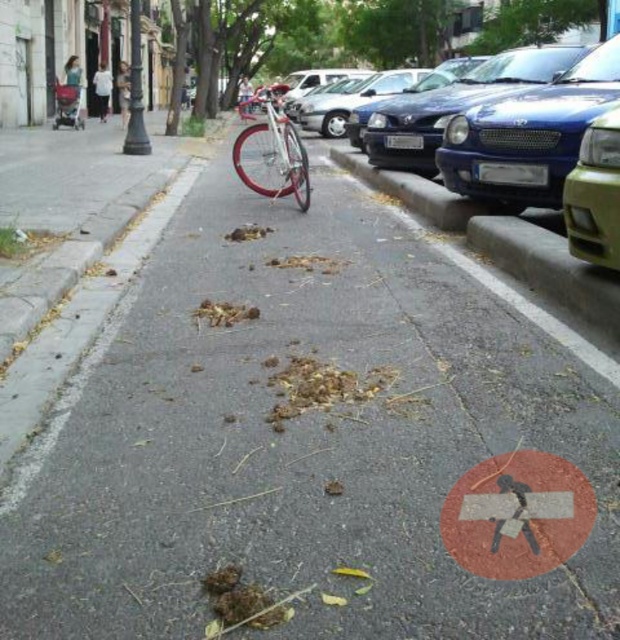
Question: Which object is farther from the camera taking this photo?

Choices:
 (A) red painted pedestrian crossing sign at lower center
 (B) shiny silver bicycle at center

Answer: (B)

Question: Can you confirm if red painted pedestrian crossing sign at lower center is positioned above shiny silver bicycle at center?

Choices:
 (A) no
 (B) yes

Answer: (A)

Question: Is red painted pedestrian crossing sign at lower center to the left of shiny silver bicycle at center from the viewer's perspective?

Choices:
 (A) yes
 (B) no

Answer: (B)

Question: Which point is farther from the camera taking this photo?

Choices:
 (A) (577, 512)
 (B) (285, 141)

Answer: (B)

Question: Can you confirm if red painted pedestrian crossing sign at lower center is positioned above shiny silver bicycle at center?

Choices:
 (A) no
 (B) yes

Answer: (A)

Question: Among these points, which one is nearest to the camera?

Choices:
 (A) (277, 195)
 (B) (547, 518)

Answer: (B)